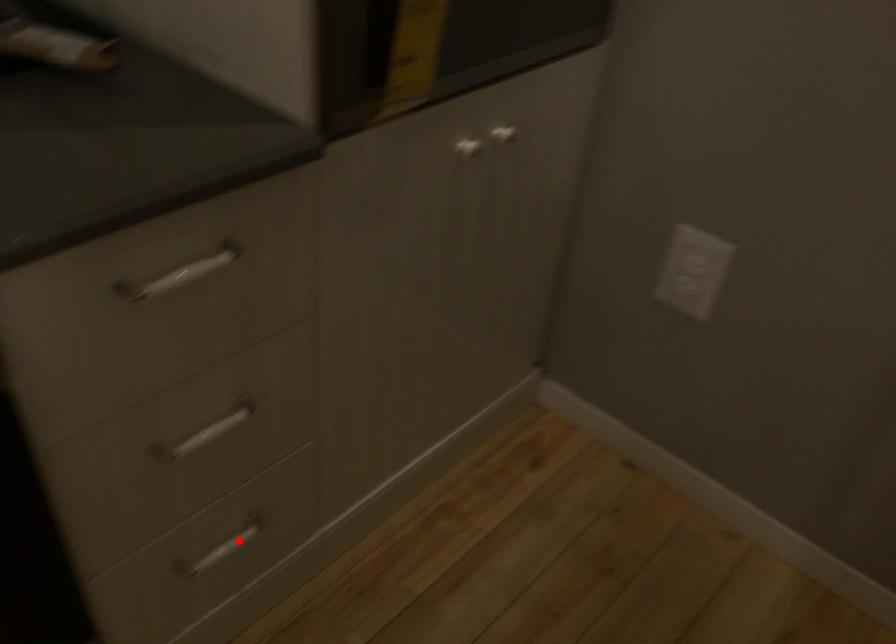
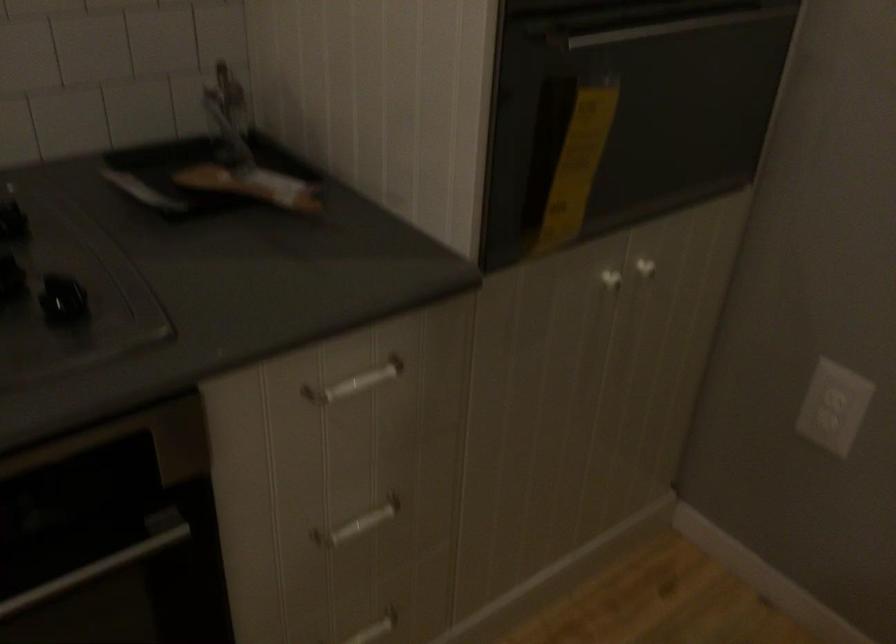
Find the pixel in the second image that matches the highlighted location in the first image.

(374, 629)